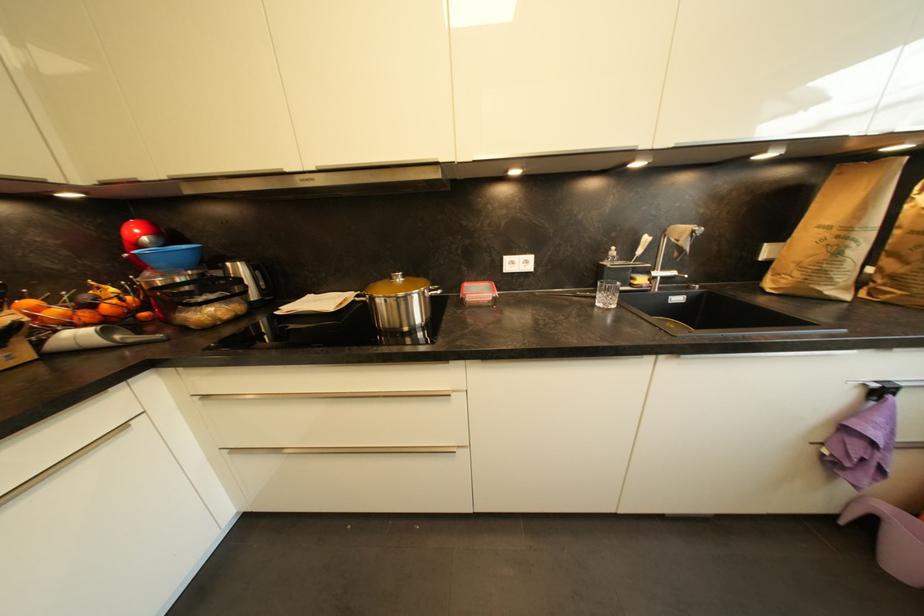
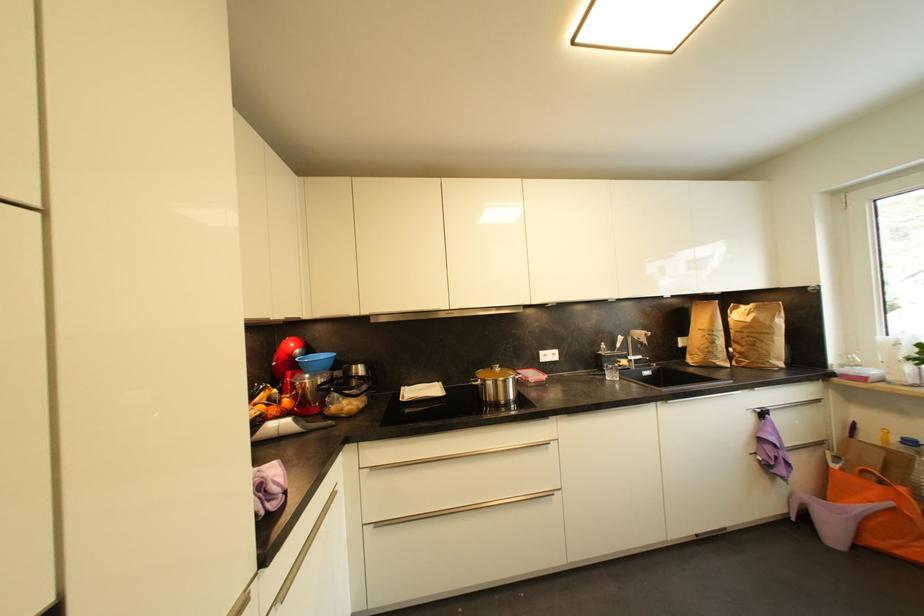
Locate, in the second image, the point that corresponds to pixel 144 249 in the first image.

(297, 359)